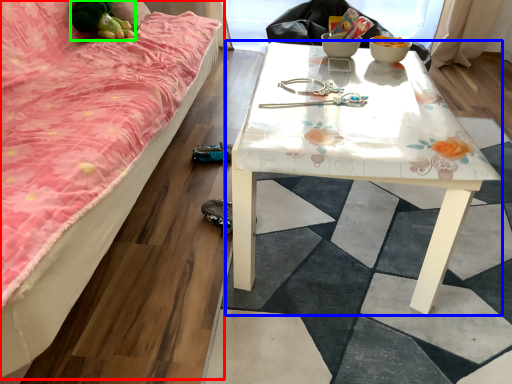
Question: Estimate the real-world distances between objects in this image. Which object is closer to studio couch (highlighted by a red box), table (highlighted by a blue box) or toy (highlighted by a green box)?

Choices:
 (A) table
 (B) toy

Answer: (A)